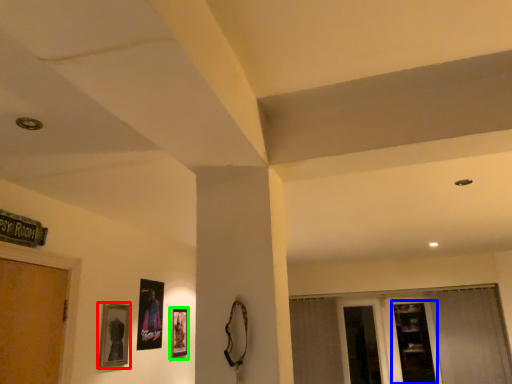
Question: Based on their relative distances, which object is farther from picture frame (highlighted by a red box)? Choose from shelf (highlighted by a blue box) and picture frame (highlighted by a green box).

Choices:
 (A) shelf
 (B) picture frame

Answer: (A)